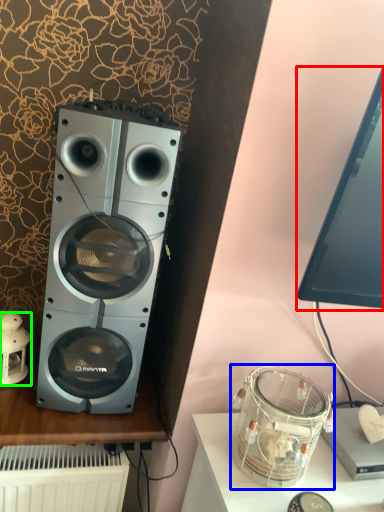
Question: Considering the real-world distances, which object is farthest from computer monitor (highlighted by a red box)? appliance (highlighted by a blue box) or toy (highlighted by a green box)?

Choices:
 (A) appliance
 (B) toy

Answer: (B)